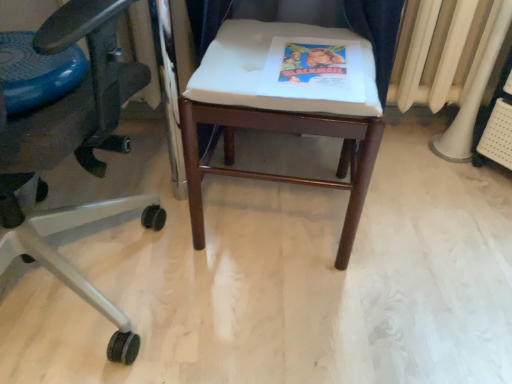
The height and width of the screenshot is (384, 512). What are the coordinates of `free spot below white fabric stool at center (from a real-world perspective)` in the screenshot? It's located at (271, 229).